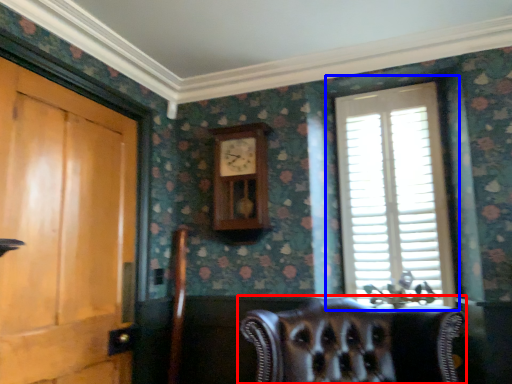
Question: Which of the following is the closest to the observer, chair (highlighted by a red box) or window (highlighted by a blue box)?

Choices:
 (A) chair
 (B) window

Answer: (A)